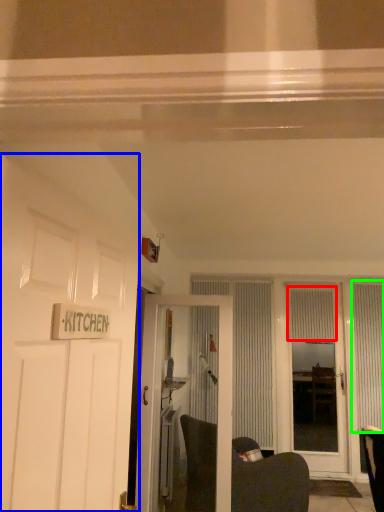
Question: Which is nearer to the curtain (highlighted by a red box)? door (highlighted by a blue box) or curtain (highlighted by a green box).

Choices:
 (A) door
 (B) curtain

Answer: (B)